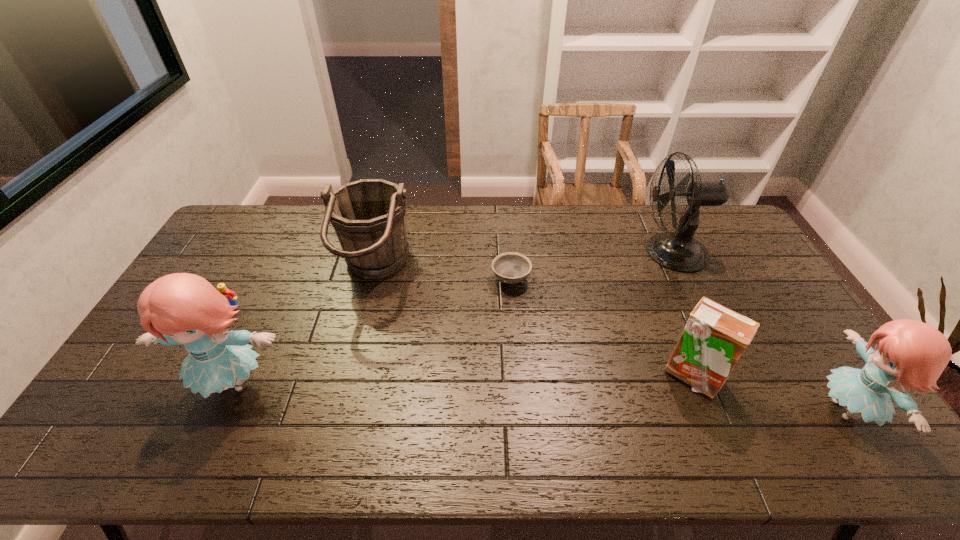
Where is `carton that is at the near edge`? This screenshot has height=540, width=960. carton that is at the near edge is located at coordinates (714, 338).

Where is `doll that is positioned at the left edge`? The width and height of the screenshot is (960, 540). doll that is positioned at the left edge is located at coordinates (185, 309).

Find the location of a particular element. This screenshot has height=540, width=960. Lego at the left edge is located at coordinates (230, 295).

Where is `doll that is at the right edge`? doll that is at the right edge is located at coordinates (911, 354).

Identify the location of fan located at the right edge. This screenshot has width=960, height=540. (678, 251).

Find the location of a particular element. This screenshot has height=540, width=960. object present at the near left corner is located at coordinates (185, 309).

The width and height of the screenshot is (960, 540). I want to click on object that is at the far right corner, so click(x=678, y=251).

At what (x,y) coordinates should I click in order to perform the action: click on object that is at the near right corner. Please return your answer as a coordinate pair (x, y). This screenshot has height=540, width=960. Looking at the image, I should click on (911, 354).

The width and height of the screenshot is (960, 540). In the image, there is a desktop. Identify the location of vacant space at the far edge. (307, 231).

Where is `free region at the near edge`? free region at the near edge is located at coordinates (368, 388).